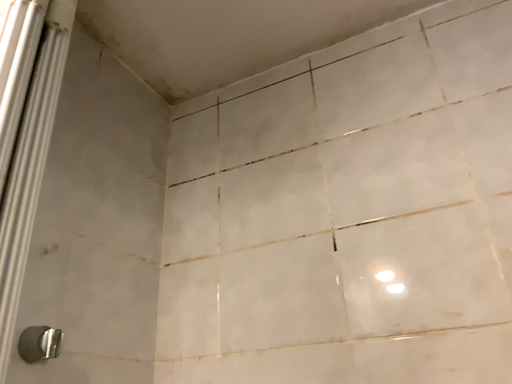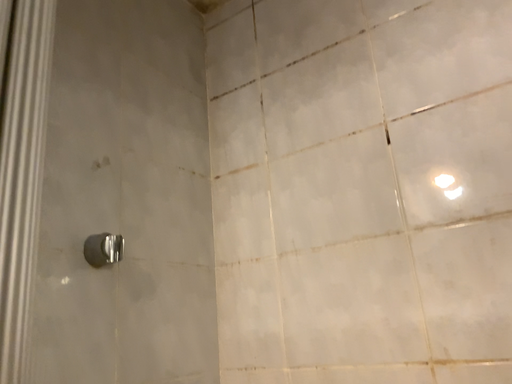
Question: Which way did the camera rotate in the video?

Choices:
 (A) rotated upward
 (B) rotated downward

Answer: (B)